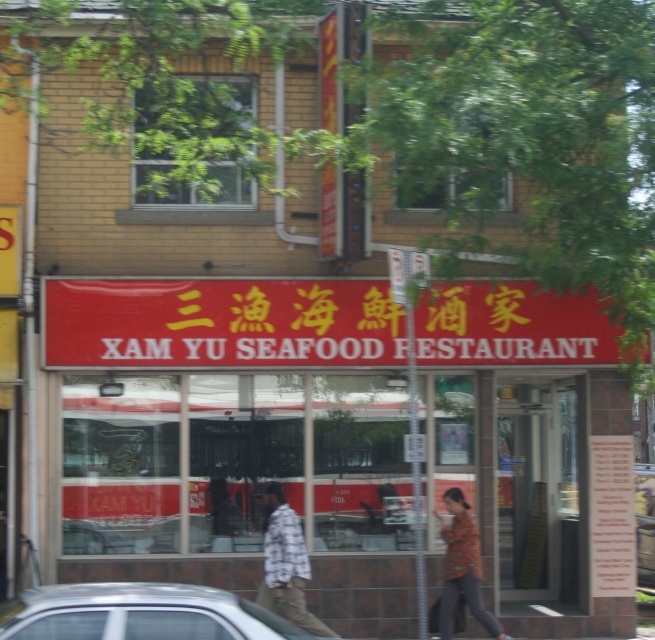
Between flannel shirt at center and floral-patterned jacket at lower right, which one appears on the right side from the viewer's perspective?

Positioned to the right is floral-patterned jacket at lower right.

Can you confirm if flannel shirt at center is wider than floral-patterned jacket at lower right?

Yes.

Locate an element on the screen. The width and height of the screenshot is (655, 640). flannel shirt at center is located at coordinates (286, 563).

Can you confirm if red matte sign at center is positioned above floral-patterned jacket at lower right?

Correct, red matte sign at center is located above floral-patterned jacket at lower right.

Can you confirm if red matte sign at center is taller than floral-patterned jacket at lower right?

In fact, red matte sign at center may be shorter than floral-patterned jacket at lower right.

This screenshot has height=640, width=655. Describe the element at coordinates (219, 323) in the screenshot. I see `red matte sign at center` at that location.

I want to click on red matte sign at center, so click(x=219, y=323).

Who is positioned more to the left, silver metallic car at lower left or flannel shirt at center?

silver metallic car at lower left is more to the left.

Locate an element on the screen. This screenshot has height=640, width=655. silver metallic car at lower left is located at coordinates (140, 612).